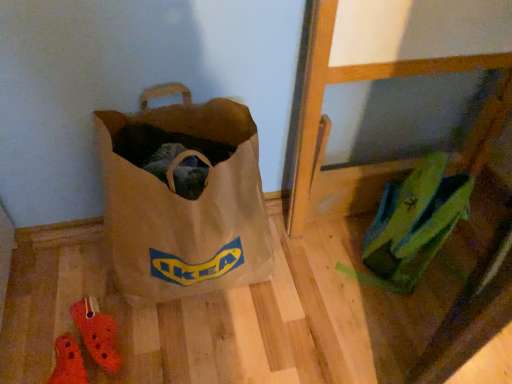
At what (x,y) coordinates should I click in order to perform the action: click on vacant region to the right of brown canvas bag at lower left. Please return your answer as a coordinate pair (x, y). Image resolution: width=512 pixels, height=384 pixels. Looking at the image, I should click on (315, 292).